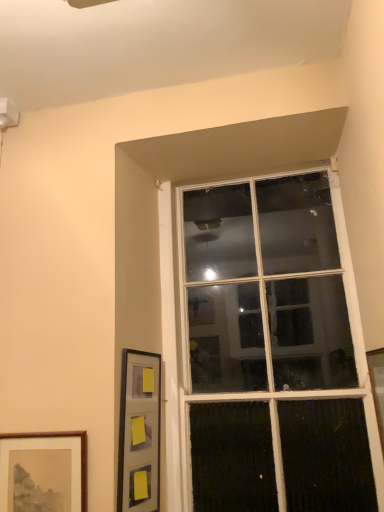
I want to click on free space above clear glass window at upper center (from a real-world perspective), so click(x=240, y=169).